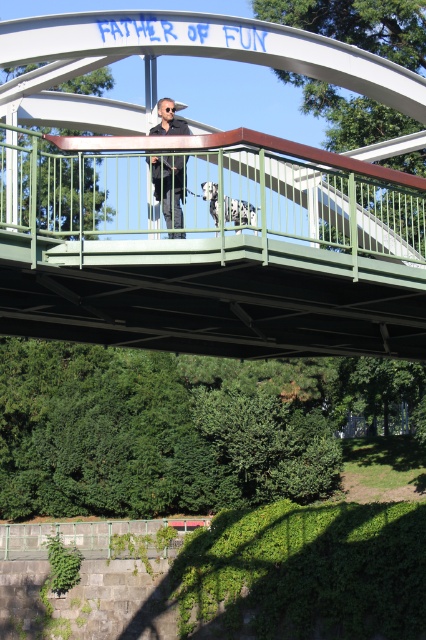
Question: Among these points, which one is nearest to the camera?

Choices:
 (A) (339, 269)
 (B) (172, 198)

Answer: (B)

Question: Does white metal bridge at center come behind matte black shirt at center?

Choices:
 (A) no
 (B) yes

Answer: (A)

Question: Which object is farther from the camera taking this photo?

Choices:
 (A) matte black shirt at center
 (B) white spotted fur at center
 (C) white metal bridge at center

Answer: (B)

Question: Which point is farther to the camera?

Choices:
 (A) white metal bridge at center
 (B) white spotted fur at center
 (C) matte black shirt at center

Answer: (B)

Question: Can you confirm if matte black shirt at center is positioned above white spotted fur at center?

Choices:
 (A) yes
 (B) no

Answer: (A)

Question: Is white metal bridge at center further to the viewer compared to white spotted fur at center?

Choices:
 (A) no
 (B) yes

Answer: (A)